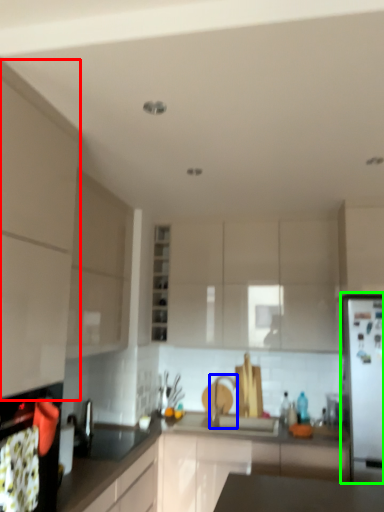
Question: Based on their relative distances, which object is farther from cabinetry (highlighted by a red box)? Choose from tap (highlighted by a blue box) and fridge (highlighted by a green box).

Choices:
 (A) tap
 (B) fridge

Answer: (A)